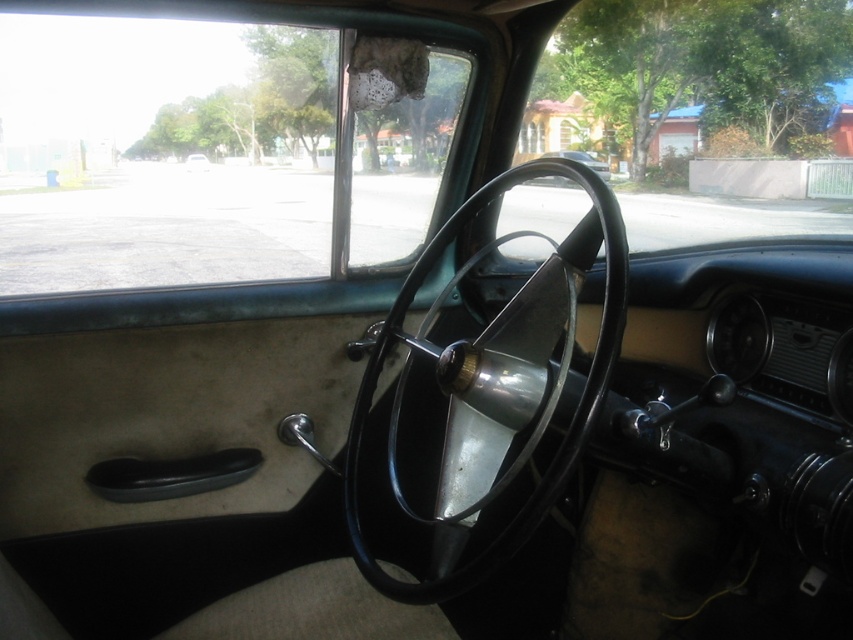
Question: Estimate the real-world distances between objects in this image. Which object is farther from the metallic silver steering wheel at center?

Choices:
 (A) metallic silver car at center
 (B) clear glass windshield at upper left

Answer: (B)

Question: Which object appears farthest from the camera in this image?

Choices:
 (A) matte black steering wheel at center
 (B) metallic silver car at center
 (C) clear glass windshield at upper left
 (D) metallic silver steering wheel at center

Answer: (A)

Question: Which point is closer to the camera?

Choices:
 (A) (521, 540)
 (B) (561, 157)

Answer: (A)

Question: Observing the image, what is the correct spatial positioning of metallic silver car at center in reference to matte black steering wheel at center?

Choices:
 (A) left
 (B) right

Answer: (B)

Question: Can you confirm if metallic silver car at center is thinner than matte black steering wheel at center?

Choices:
 (A) no
 (B) yes

Answer: (A)

Question: From the image, what is the correct spatial relationship of clear glass windshield at upper left in relation to matte black steering wheel at center?

Choices:
 (A) below
 (B) above

Answer: (A)